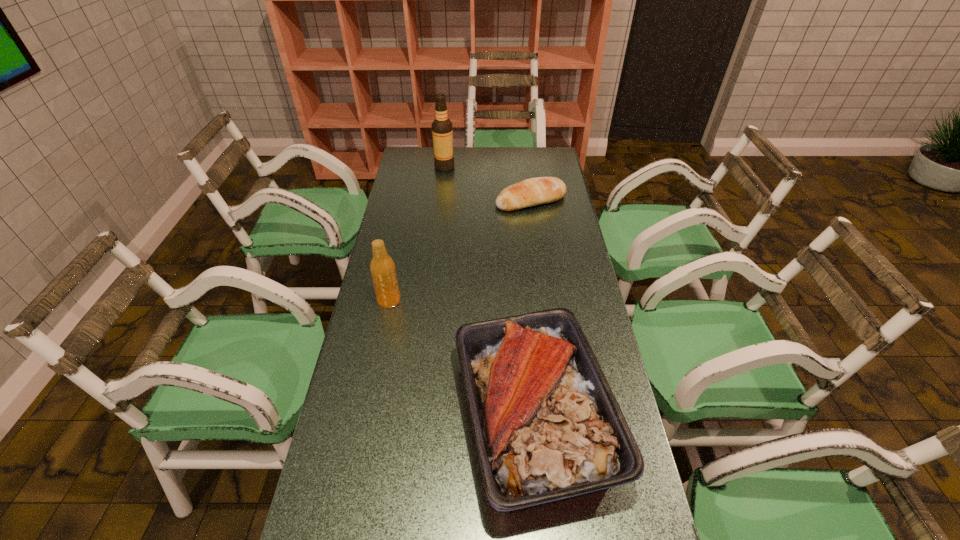
Where is `the second object from left to right`? Image resolution: width=960 pixels, height=540 pixels. the second object from left to right is located at coordinates (442, 131).

In order to click on the tallest object in this screenshot , I will do `click(442, 131)`.

You are a GUI agent. You are given a task and a screenshot of the screen. Output one action in this format:
    pyautogui.click(x=<x>, y=<y>)
    Task: Click on the beer bottle
    The image size is (960, 540).
    Given the screenshot: What is the action you would take?
    pyautogui.click(x=382, y=267)

Image resolution: width=960 pixels, height=540 pixels. What are the coordinates of `the third shortest object` in the screenshot? It's located at (382, 267).

Find the location of a particular element. The height and width of the screenshot is (540, 960). the third tallest object is located at coordinates (547, 426).

Find the location of `tray`. tray is located at coordinates (547, 426).

This screenshot has width=960, height=540. I want to click on the shortest object, so click(x=534, y=191).

The height and width of the screenshot is (540, 960). I want to click on the third nearest object, so click(x=534, y=191).

You are a GUI agent. You are given a task and a screenshot of the screen. Output one action in this format:
    pyautogui.click(x=<x>, y=<y>)
    Task: Click on the blank space located 0.220m on the label of the farthest object
    The width and height of the screenshot is (960, 540).
    Given the screenshot: What is the action you would take?
    pyautogui.click(x=502, y=167)

This screenshot has height=540, width=960. Identify the location of free region located 0.070m on the front of the beer bottle. (384, 326).